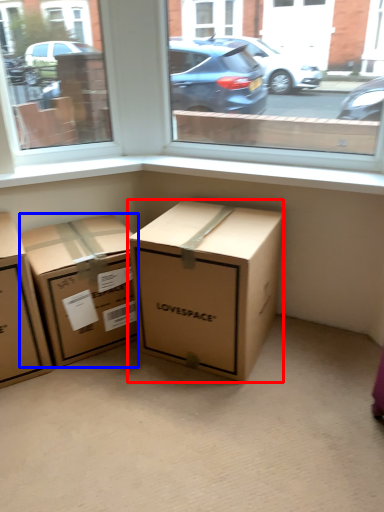
Question: Which point is further to the camera, box (highlighted by a red box) or box (highlighted by a blue box)?

Choices:
 (A) box
 (B) box

Answer: (B)